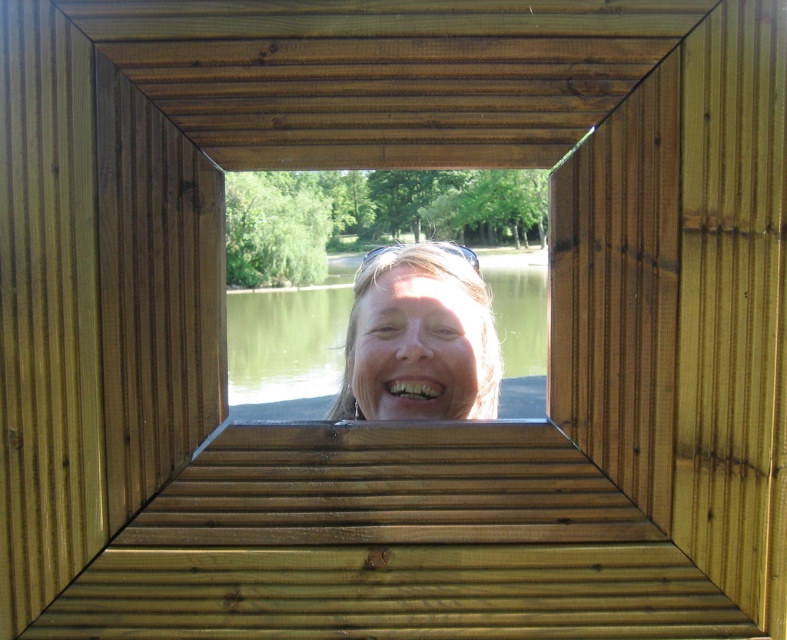
You are standing behind the wooden frame in the image and want to see the green water at center. Where should you look relative to the wooden frame?

The green water at center is located at point coordinates of (285, 352), so you should look towards the center of the image to see it.

You are a photographer trying to capture a candid shot of the matte skin face at center while ensuring the green water at center is also visible in the frame. Based on their relative sizes in the scene, which object should you focus on to ensure both are in focus?

The green water at center is much taller than the matte skin face at center, so you should focus on the green water at center to ensure both are in focus since it occupies more of the frame.